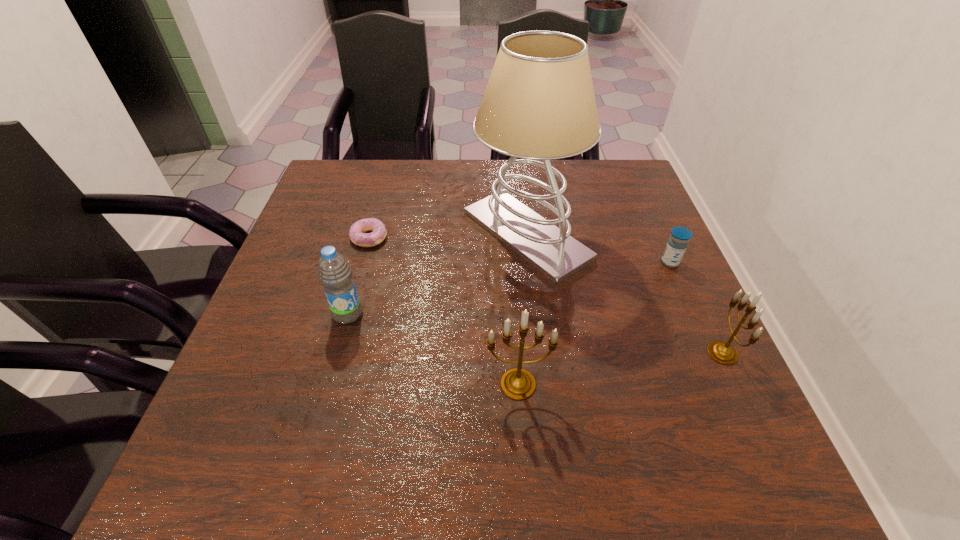
At what (x,y) coordinates should I click in order to perform the action: click on the left candelabrum. Please return your answer as a coordinate pair (x, y). The width and height of the screenshot is (960, 540). Looking at the image, I should click on click(x=517, y=383).

The image size is (960, 540). I want to click on the shorter candelabrum, so click(x=722, y=352).

Image resolution: width=960 pixels, height=540 pixels. What are the coordinates of `the tallest object` in the screenshot? It's located at (539, 104).

Where is `the shortest object`? This screenshot has height=540, width=960. the shortest object is located at coordinates (357, 231).

Where is `the second shortest object`? the second shortest object is located at coordinates (677, 243).

This screenshot has width=960, height=540. Identify the location of water bottle. (334, 272).

Image resolution: width=960 pixels, height=540 pixels. What are the coordinates of `blank area located 0.080m on the left of the taller candelabrum` in the screenshot? It's located at (443, 384).

This screenshot has height=540, width=960. Identify the location of free space located 0.260m on the left of the right candelabrum. (576, 353).

Find the location of a particular element. Image resolution: width=960 pixels, height=540 pixels. free space located on the front of the tallest object is located at coordinates (547, 416).

Where is `vacant point located 0.050m on the left of the doughnut`? vacant point located 0.050m on the left of the doughnut is located at coordinates (331, 238).